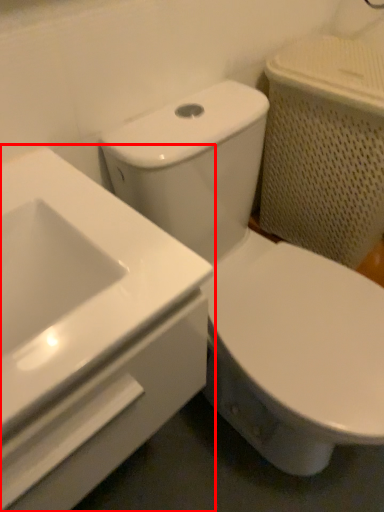
Question: Observing the image, what is the correct spatial positioning of sink (annotated by the red box) in reference to toilet?

Choices:
 (A) right
 (B) left

Answer: (B)